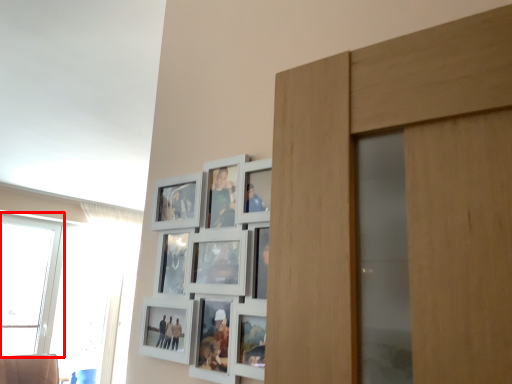
Question: From the image's perspective, considering the relative positions of window (annotated by the red box) and window in the image provided, where is window (annotated by the red box) located with respect to the staircase?

Choices:
 (A) below
 (B) above

Answer: (B)